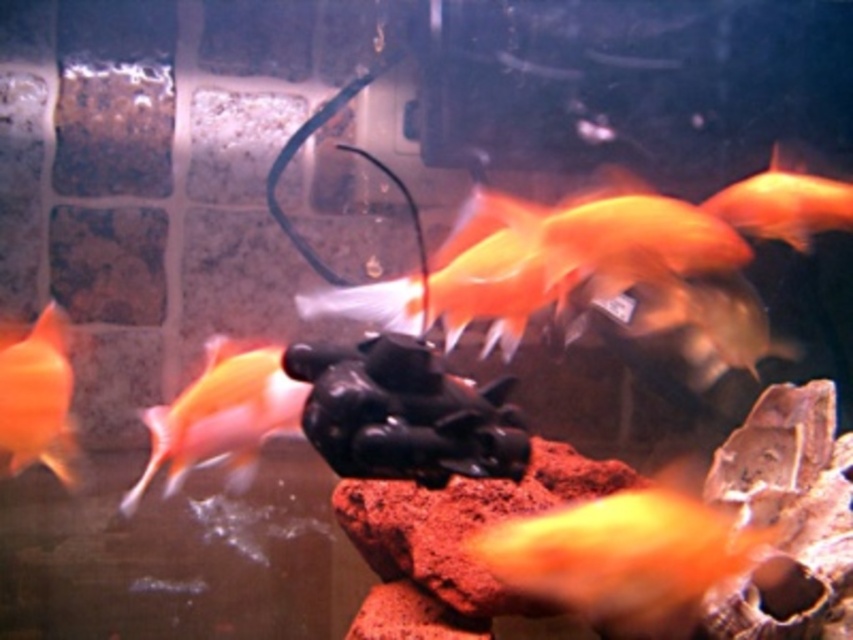
Question: Which of these objects is positioned farthest from the orange matte goldfish at upper right?

Choices:
 (A) shiny orange fish at center
 (B) matte orange fish at lower left
 (C) matte orange fish at left

Answer: (C)

Question: Does matte orange fish at left have a larger size compared to orange matte goldfish at upper right?

Choices:
 (A) yes
 (B) no

Answer: (B)

Question: Is shiny orange fish at center to the right of matte orange fish at lower left from the viewer's perspective?

Choices:
 (A) yes
 (B) no

Answer: (A)

Question: Does shiny orange fish at center lie in front of orange matte goldfish at upper right?

Choices:
 (A) yes
 (B) no

Answer: (A)

Question: Which point is closer to the camera?

Choices:
 (A) matte orange fish at left
 (B) shiny orange fish at center
 (C) matte orange fish at lower left

Answer: (C)

Question: Which object is the farthest from the matte orange fish at lower left?

Choices:
 (A) shiny orange fish at center
 (B) matte orange fish at left
 (C) orange matte goldfish at upper right

Answer: (C)